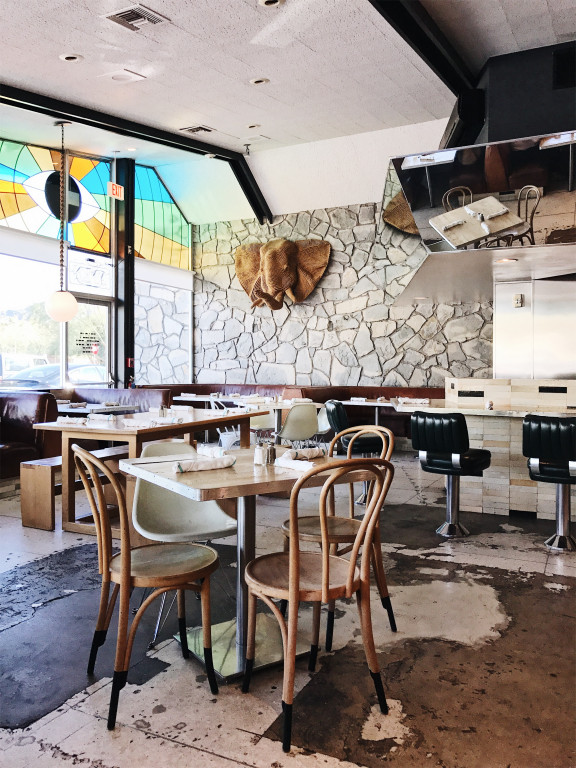
At what (x,y) coordinates should I click in order to perform the action: click on table. Please return your answer as a coordinate pair (x, y). Image resolution: width=576 pixels, height=768 pixels. Looking at the image, I should click on (223, 482).